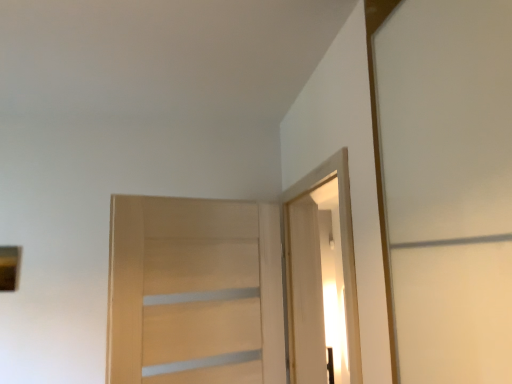
Question: Is white glossy elevator at upper right further to the viewer compared to white wood door at upper right, which appears as the first door when viewed from the right?

Choices:
 (A) no
 (B) yes

Answer: (A)

Question: Would you consider white glossy elevator at upper right to be distant from white wood door at upper right, which is the second door in left-to-right order?

Choices:
 (A) no
 (B) yes

Answer: (A)

Question: Is white glossy elevator at upper right thinner than white wood door at upper right, which is the second door in left-to-right order?

Choices:
 (A) yes
 (B) no

Answer: (A)

Question: Is white glossy elevator at upper right facing towards white wood door at upper right, which is the second door in left-to-right order?

Choices:
 (A) yes
 (B) no

Answer: (B)

Question: Can you confirm if white glossy elevator at upper right is positioned to the right of white wood door at upper right, which appears as the first door when viewed from the right?

Choices:
 (A) yes
 (B) no

Answer: (A)

Question: Considering the relative sizes of white glossy elevator at upper right and white wood door at upper right, which is the second door in left-to-right order, in the image provided, is white glossy elevator at upper right wider than white wood door at upper right, which is the second door in left-to-right order,?

Choices:
 (A) no
 (B) yes

Answer: (A)

Question: Does white wood door at upper right, which appears as the first door when viewed from the right, contain light wood door at center, which is the 2th door from right to left?

Choices:
 (A) no
 (B) yes

Answer: (A)

Question: Is white wood door at upper right, which appears as the first door when viewed from the right, outside light wood door at center, which is counted as the first door, starting from the left?

Choices:
 (A) no
 (B) yes

Answer: (B)

Question: Does white wood door at upper right, which is the second door in left-to-right order, have a greater height compared to light wood door at center, which is counted as the first door, starting from the left?

Choices:
 (A) yes
 (B) no

Answer: (A)

Question: Considering the relative sizes of white wood door at upper right, which appears as the first door when viewed from the right, and light wood door at center, which is the 2th door from right to left, in the image provided, is white wood door at upper right, which appears as the first door when viewed from the right, bigger than light wood door at center, which is the 2th door from right to left,?

Choices:
 (A) no
 (B) yes

Answer: (A)

Question: Can you confirm if white wood door at upper right, which is the second door in left-to-right order, is thinner than light wood door at center, which is counted as the first door, starting from the left?

Choices:
 (A) no
 (B) yes

Answer: (A)

Question: From the image's perspective, does white wood door at upper right, which appears as the first door when viewed from the right, appear lower than light wood door at center, which is the 2th door from right to left?

Choices:
 (A) no
 (B) yes

Answer: (B)

Question: Does white glossy elevator at upper right have a lesser width compared to light wood door at center, which is the 2th door from right to left?

Choices:
 (A) yes
 (B) no

Answer: (B)